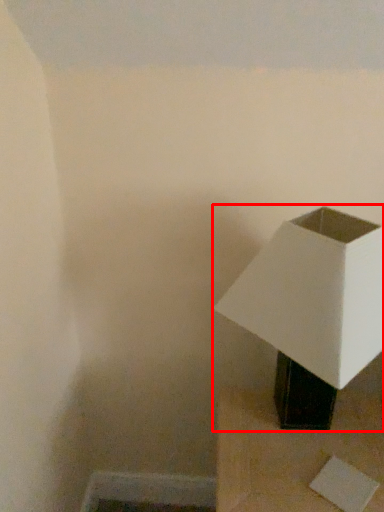
Question: From the image's perspective, where is lamp (annotated by the red box) located in relation to furniture in the image?

Choices:
 (A) below
 (B) above

Answer: (B)